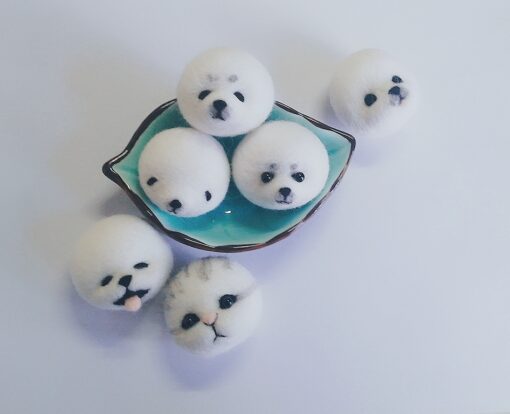
I want to click on floor, so click(x=342, y=300).